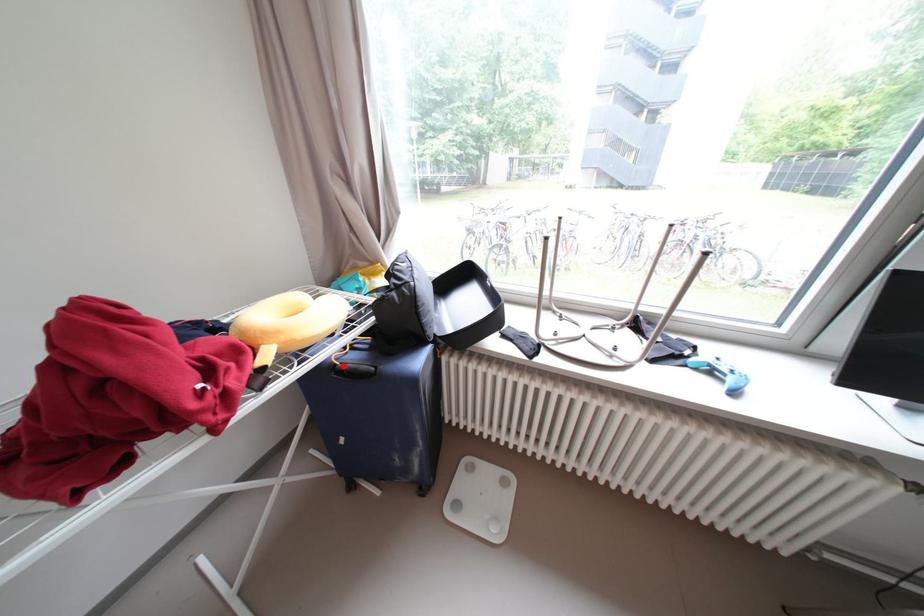
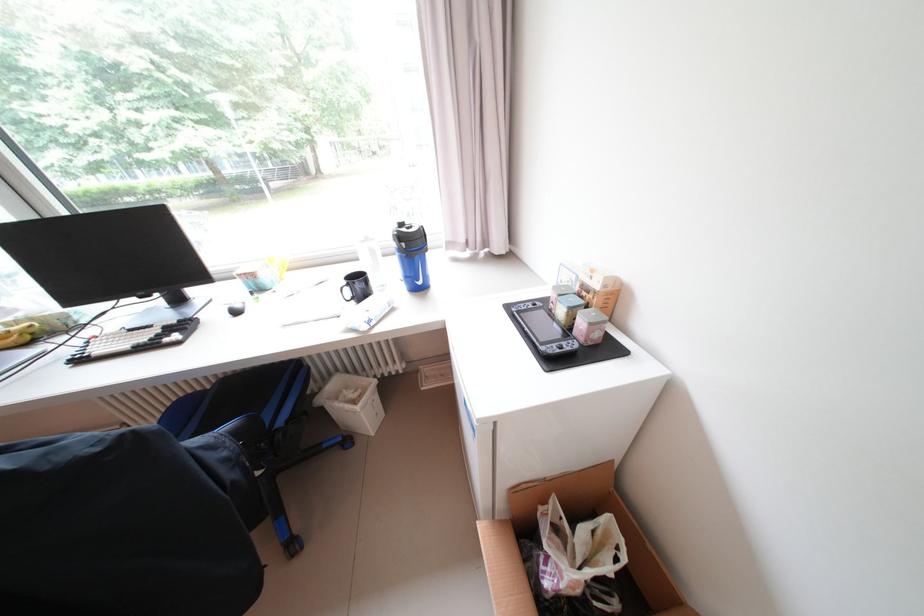
Question: I am providing you with two images of the same scene from different viewpoints. A red point is marked on the first image. Is the red point's position out of view in image 2?

Choices:
 (A) Yes
 (B) No

Answer: (A)